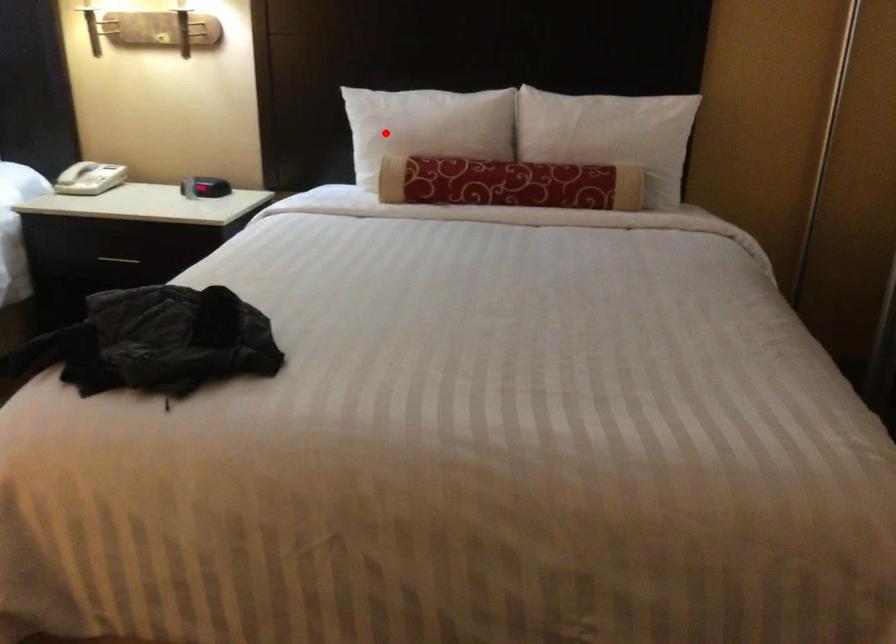
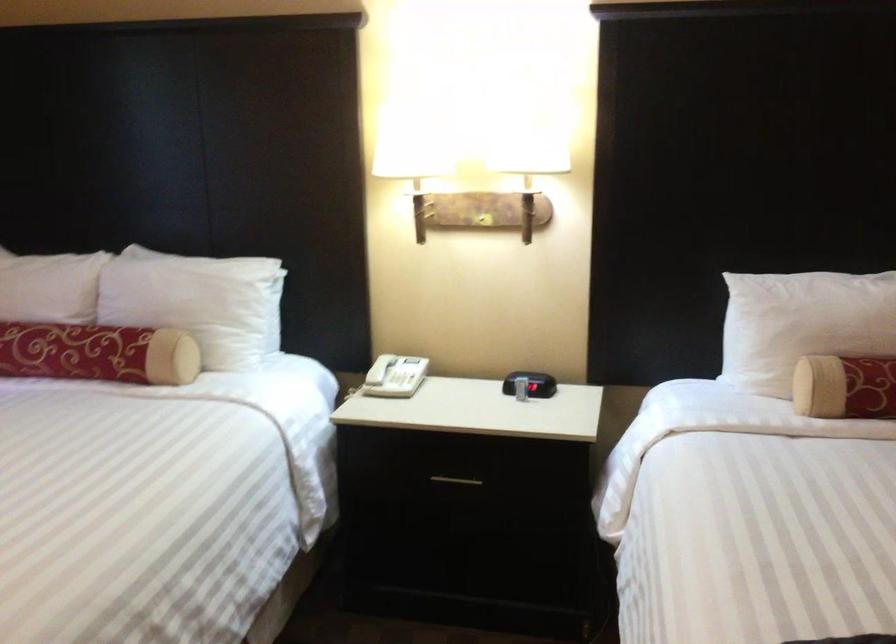
Question: I am providing you with two images of the same scene from different viewpoints. In image1, a red point is highlighted. Considering the same 3D point in image2, which of the following is correct?

Choices:
 (A) It is closer
 (B) It is farther

Answer: (A)